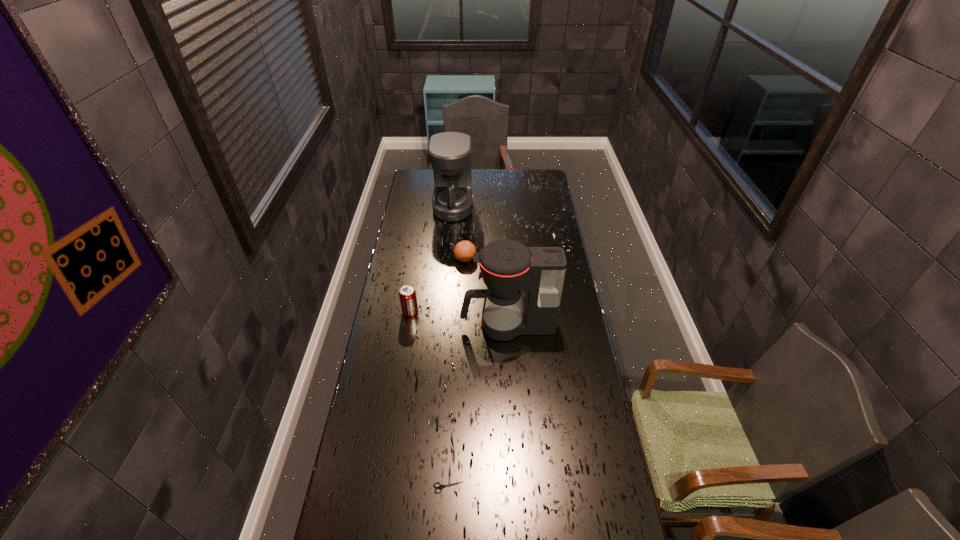
Find the location of a particular element. This screenshot has width=960, height=540. the nearer coffee maker is located at coordinates (507, 267).

At what (x,y) coordinates should I click in order to perform the action: click on the farthest object. Please return your answer as a coordinate pair (x, y). Looking at the image, I should click on (450, 153).

The width and height of the screenshot is (960, 540). Find the location of `the leftmost object`. the leftmost object is located at coordinates point(407,294).

I want to click on soda can, so click(407, 294).

Identify the location of the fourth tallest object. (463, 251).

At what (x,y) coordinates should I click in order to perform the action: click on the fourth nearest object. Please return your answer as a coordinate pair (x, y). This screenshot has height=540, width=960. Looking at the image, I should click on (463, 251).

The height and width of the screenshot is (540, 960). Find the location of `the nearest object`. the nearest object is located at coordinates (440, 486).

This screenshot has height=540, width=960. What are the coordinates of `the shortest object` in the screenshot? It's located at (440, 486).

The height and width of the screenshot is (540, 960). Identify the location of free space located 0.230m pour from the carafe of the nearer coffee maker. (403, 325).

Where is `free space located pour from the carafe of the nearer coffee maker`? free space located pour from the carafe of the nearer coffee maker is located at coordinates (448, 325).